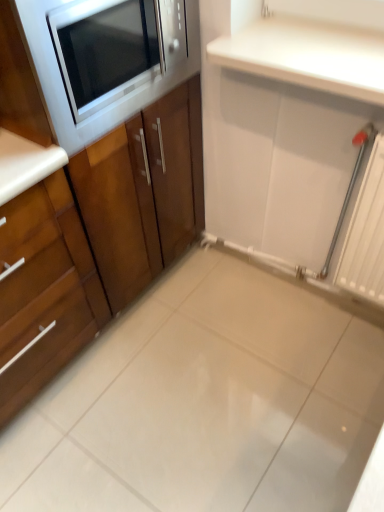
Question: Does wooden cabinet at left, placed as the 2th cabinetry when sorted from right to left, have a greater width compared to white glossy ceramic tile at center?

Choices:
 (A) no
 (B) yes

Answer: (A)

Question: Considering the relative sizes of wooden cabinet at left, placed as the 2th cabinetry when sorted from right to left, and white glossy ceramic tile at center in the image provided, is wooden cabinet at left, placed as the 2th cabinetry when sorted from right to left, smaller than white glossy ceramic tile at center?

Choices:
 (A) no
 (B) yes

Answer: (A)

Question: From the image's perspective, is wooden cabinet at left, placed as the 2th cabinetry when sorted from right to left, on white glossy ceramic tile at center?

Choices:
 (A) no
 (B) yes

Answer: (B)

Question: Is wooden cabinet at left, placed as the 2th cabinetry when sorted from right to left, positioned before white glossy ceramic tile at center?

Choices:
 (A) no
 (B) yes

Answer: (B)

Question: Is wooden cabinet at left, which appears as the first cabinetry when viewed from the left, oriented towards white glossy ceramic tile at center?

Choices:
 (A) yes
 (B) no

Answer: (A)

Question: From their relative heights in the image, would you say wooden cabinet at left, the second cabinetry in the left-to-right sequence, is taller or shorter than wooden cabinet at left, placed as the 2th cabinetry when sorted from right to left?

Choices:
 (A) short
 (B) tall

Answer: (B)

Question: Considering their positions, is wooden cabinet at left, arranged as the first cabinetry when viewed from the right, located in front of or behind wooden cabinet at left, placed as the 2th cabinetry when sorted from right to left?

Choices:
 (A) behind
 (B) front

Answer: (A)

Question: From a real-world perspective, is wooden cabinet at left, the second cabinetry in the left-to-right sequence, positioned above or below wooden cabinet at left, placed as the 2th cabinetry when sorted from right to left?

Choices:
 (A) below
 (B) above

Answer: (B)

Question: From the image's perspective, is wooden cabinet at left, arranged as the first cabinetry when viewed from the right, positioned above or below wooden cabinet at left, placed as the 2th cabinetry when sorted from right to left?

Choices:
 (A) below
 (B) above

Answer: (B)

Question: Looking at the image, does white glossy ceramic tile at center seem bigger or smaller compared to matte black microwave at upper left?

Choices:
 (A) big
 (B) small

Answer: (B)

Question: In terms of width, does white glossy ceramic tile at center look wider or thinner when compared to matte black microwave at upper left?

Choices:
 (A) wide
 (B) thin

Answer: (A)

Question: Do you think white glossy ceramic tile at center is within matte black microwave at upper left, or outside of it?

Choices:
 (A) inside
 (B) outside

Answer: (B)

Question: Is white glossy ceramic tile at center in front of or behind matte black microwave at upper left in the image?

Choices:
 (A) front
 (B) behind

Answer: (B)

Question: From a real-world perspective, is white glossy ceramic tile at center above or below wooden cabinet at left, placed as the 2th cabinetry when sorted from right to left?

Choices:
 (A) above
 (B) below

Answer: (B)

Question: From the image's perspective, is white glossy ceramic tile at center above or below wooden cabinet at left, which appears as the first cabinetry when viewed from the left?

Choices:
 (A) below
 (B) above

Answer: (A)